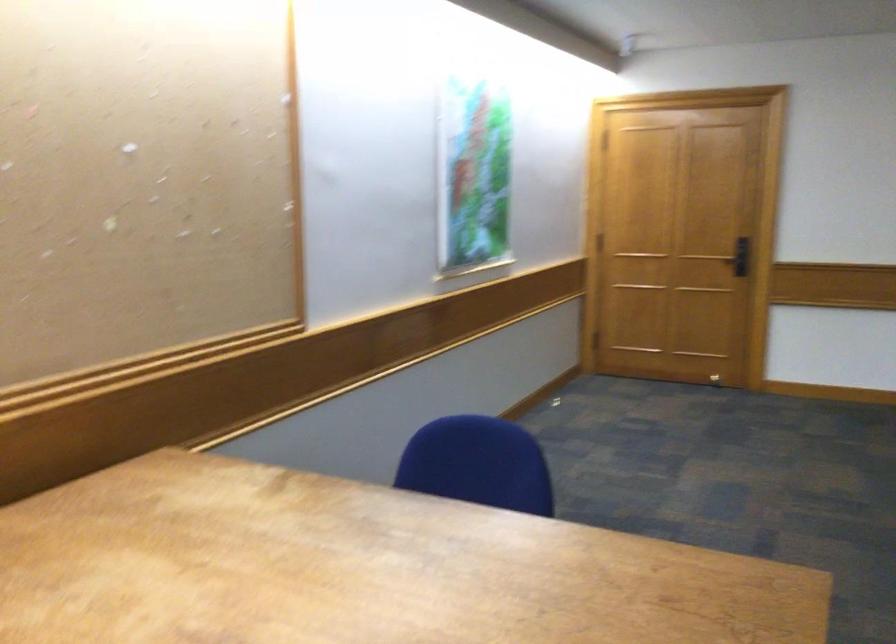
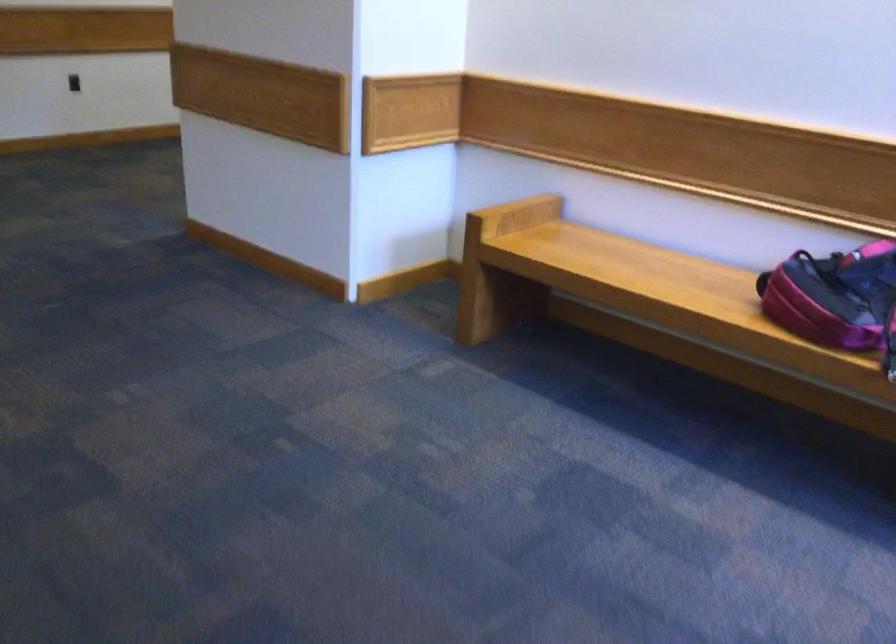
The images are taken continuously from a first-person perspective. In which direction is your viewpoint rotating?

The camera's rotation is toward right-down.